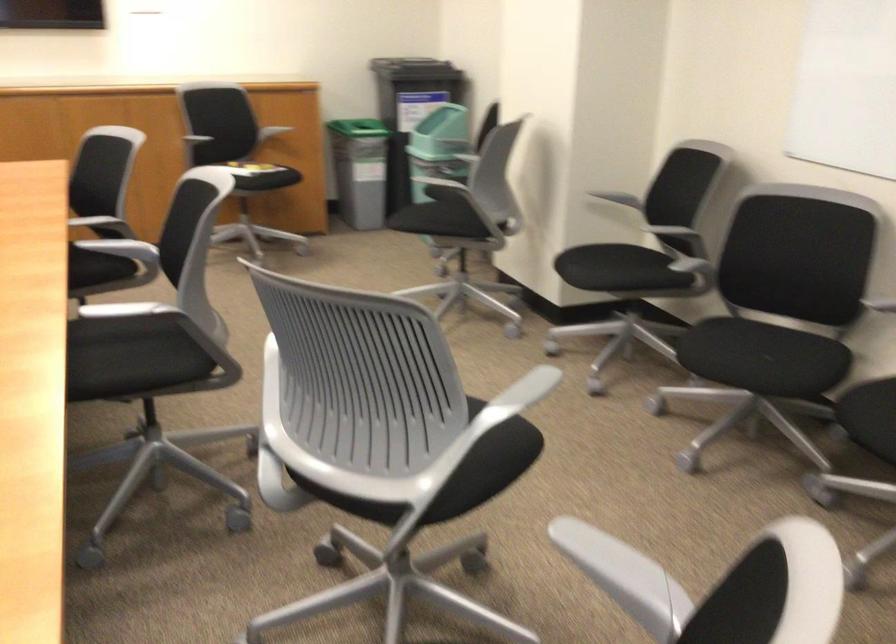
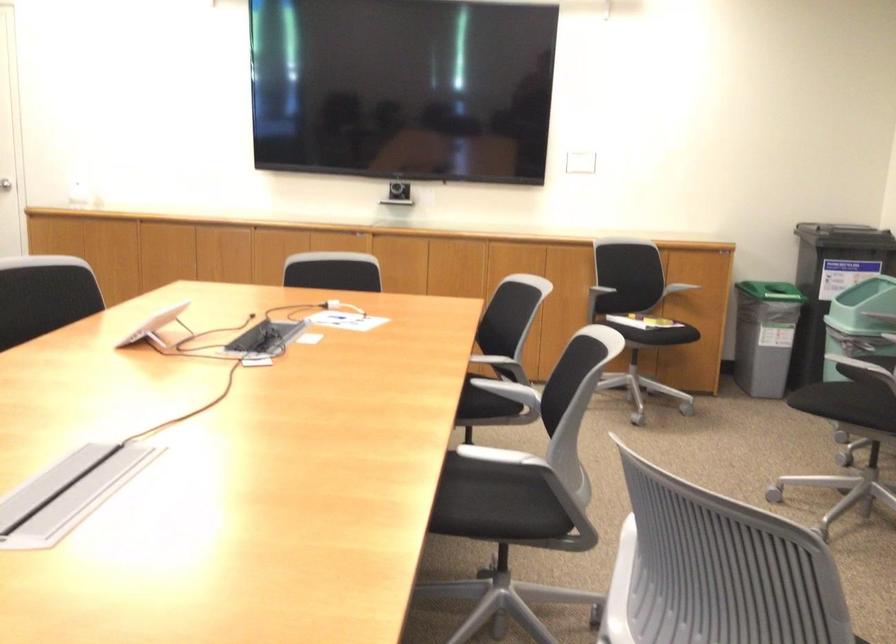
In the second image, find the point that corresponds to pixel 128 313 in the first image.

(492, 460)